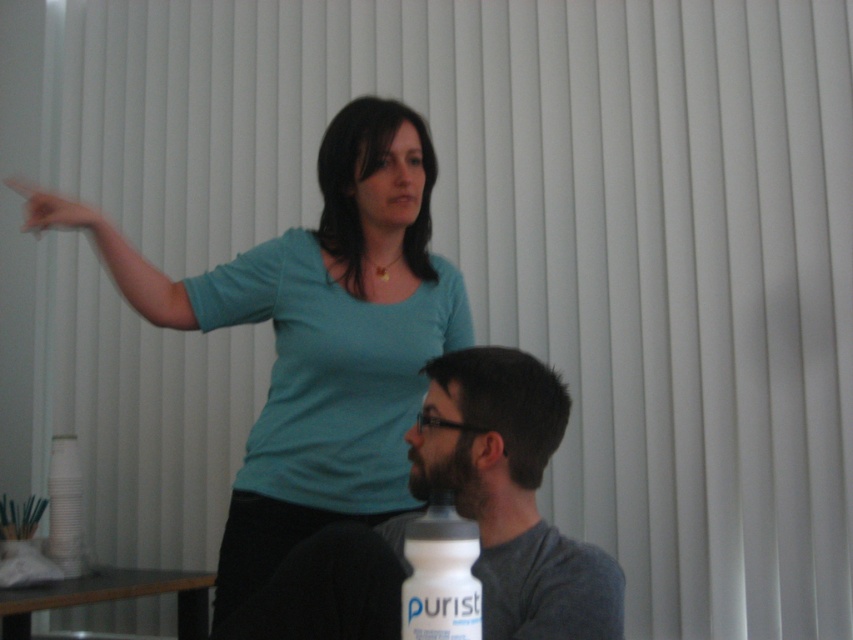
Looking at this image, can you confirm if teal matte shirt at upper center is positioned above matte skin hand at upper left?

No.

Identify the location of teal matte shirt at upper center. Image resolution: width=853 pixels, height=640 pixels. (325, 340).

Image resolution: width=853 pixels, height=640 pixels. In order to click on teal matte shirt at upper center in this screenshot , I will do `click(325, 340)`.

Locate an element on the screen. teal matte shirt at upper center is located at coordinates (325, 340).

Is point (425, 216) positioned in front of point (416, 593)?

No, it is behind (416, 593).

Where is `teal matte shirt at upper center`? teal matte shirt at upper center is located at coordinates (325, 340).

In the scene shown: Which of these two, gray matte shirt at lower center or matte skin hand at upper left, stands shorter?

matte skin hand at upper left is shorter.

Who is more distant from viewer, (482, 588) or (39, 218)?

Point (39, 218)

You are a GUI agent. You are given a task and a screenshot of the screen. Output one action in this format:
    pyautogui.click(x=<x>, y=<y>)
    Task: Click on the gray matte shirt at lower center
    This screenshot has width=853, height=640.
    Given the screenshot: What is the action you would take?
    pyautogui.click(x=511, y=493)